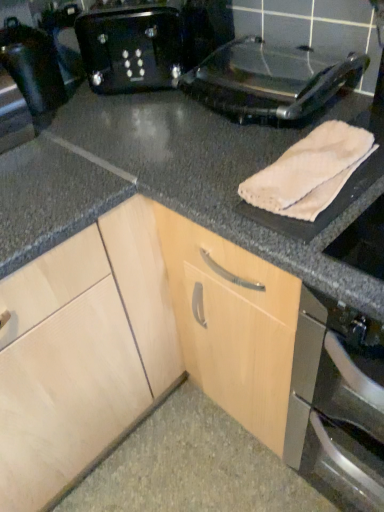
The height and width of the screenshot is (512, 384). What do you see at coordinates (13, 115) in the screenshot?
I see `shiny black toaster at left` at bounding box center [13, 115].

The height and width of the screenshot is (512, 384). I want to click on white fabric towel at right, so click(334, 412).

The image size is (384, 512). What do you see at coordinates (334, 412) in the screenshot?
I see `white fabric towel at right` at bounding box center [334, 412].

Measure the distance between point (178, 41) and camera.

Point (178, 41) and camera are 1.08 meters apart from each other.

What do you see at coordinates (149, 42) in the screenshot? This screenshot has height=512, width=384. I see `black plastic toaster at upper center` at bounding box center [149, 42].

Where is `shiny black toaster at left`? shiny black toaster at left is located at coordinates (13, 115).

Which object is positioned more to the right, metallic black toaster at upper right or beige soft towel at upper right?

beige soft towel at upper right is more to the right.

Looking at their sizes, would you say metallic black toaster at upper right is wider or thinner than beige soft towel at upper right?

metallic black toaster at upper right is wider than beige soft towel at upper right.

Is metallic black toaster at upper right outside of beige soft towel at upper right?

That's correct, metallic black toaster at upper right is outside of beige soft towel at upper right.

Between black plastic toaster at upper center and shiny black toaster at left, which one has larger size?

black plastic toaster at upper center.

Would you say black plastic toaster at upper center is inside or outside shiny black toaster at left?

black plastic toaster at upper center is spatially situated outside shiny black toaster at left.

Considering the relative sizes of black plastic toaster at upper center and shiny black toaster at left in the image provided, is black plastic toaster at upper center wider than shiny black toaster at left?

Yes.

Considering the positions of point (107, 31) and point (12, 136), is point (107, 31) closer or farther from the camera than point (12, 136)?

Point (107, 31) is farther from the camera than point (12, 136).

Which object is closer to the camera taking this photo, beige soft towel at upper right or shiny black toaster at left?

beige soft towel at upper right is more forward.

Based on the photo, based on their positions, is beige soft towel at upper right located to the left or right of shiny black toaster at left?

In the image, beige soft towel at upper right appears on the right side of shiny black toaster at left.

Is point (323, 153) positioned in front of point (1, 140)?

That is True.

Is beige soft towel at upper right oriented towards shiny black toaster at left?

No, beige soft towel at upper right is not oriented towards shiny black toaster at left.

Who is shorter, black plastic toaster at upper center or white fabric towel at right?

With less height is black plastic toaster at upper center.

From the image's perspective, would you say black plastic toaster at upper center is shown under white fabric towel at right?

No, from the image's perspective, black plastic toaster at upper center is not below white fabric towel at right.

Could white fabric towel at right be considered to be inside black plastic toaster at upper center?

Definitely not — white fabric towel at right is not inside black plastic toaster at upper center.

From the picture: Measure the distance from black plastic toaster at upper center to white fabric towel at right.

black plastic toaster at upper center and white fabric towel at right are 33.25 inches apart from each other.

Which of these two, white fabric towel at right or beige soft towel at upper right, is wider?

With larger width is white fabric towel at right.

Considering the sizes of objects white fabric towel at right and beige soft towel at upper right in the image provided, who is bigger, white fabric towel at right or beige soft towel at upper right?

With larger size is white fabric towel at right.

Can we say white fabric towel at right lies outside beige soft towel at upper right?

Yes, white fabric towel at right is located beyond the bounds of beige soft towel at upper right.

Does white fabric towel at right appear on the left side of beige soft towel at upper right?

In fact, white fabric towel at right is to the right of beige soft towel at upper right.

Is metallic black toaster at upper right bigger or smaller than black plastic toaster at upper center?

In the image, metallic black toaster at upper right appears to be larger than black plastic toaster at upper center.

From the picture: Is metallic black toaster at upper right at the right side of black plastic toaster at upper center?

Indeed, metallic black toaster at upper right is positioned on the right side of black plastic toaster at upper center.

Can you tell me how much metallic black toaster at upper right and black plastic toaster at upper center differ in facing direction?

There is a 43.9-degree angle between the facing directions of metallic black toaster at upper right and black plastic toaster at upper center.

Which is in front, metallic black toaster at upper right or black plastic toaster at upper center?

metallic black toaster at upper right is closer to the camera.

I want to click on bath towel below the black plastic toaster at upper center (from the image's perspective), so click(x=310, y=170).

Consider the image. Is black plastic toaster at upper center closer to camera compared to beige soft towel at upper right?

No.

From a real-world perspective, which is physically above, black plastic toaster at upper center or beige soft towel at upper right?

black plastic toaster at upper center, from a real-world perspective.

In the scene shown: Between black plastic toaster at upper center and beige soft towel at upper right, which one has larger size?

Bigger between the two is black plastic toaster at upper center.

Where is `bath towel directly beneath the metallic black toaster at upper right (from a real-world perspective)`? bath towel directly beneath the metallic black toaster at upper right (from a real-world perspective) is located at coordinates (310, 170).

At what (x,y) coordinates should I click in order to perform the action: click on toaster on the right side of shiny black toaster at left. Please return your answer as a coordinate pair (x, y). This screenshot has width=384, height=512. Looking at the image, I should click on (149, 42).

When comparing their distances from shiny black toaster at left, does black plastic toaster at upper center or metallic black toaster at upper right seem further?

metallic black toaster at upper right is positioned further to the anchor shiny black toaster at left.

Looking at the image, which one is located further to metallic black toaster at upper right, beige soft towel at upper right or shiny black toaster at left?

shiny black toaster at left is further to metallic black toaster at upper right.

When comparing their distances from shiny black toaster at left, does metallic black toaster at upper right or beige soft towel at upper right seem further?

Among the two, beige soft towel at upper right is located further to shiny black toaster at left.

Looking at the image, which one is located further to beige soft towel at upper right, white fabric towel at right or metallic black toaster at upper right?

white fabric towel at right is positioned further to the anchor beige soft towel at upper right.

Which object lies nearer to the anchor point black plastic toaster at upper center, white fabric towel at right or beige soft towel at upper right?

beige soft towel at upper right is positioned closer to the anchor black plastic toaster at upper center.

From the image, which object appears to be farther from black plastic toaster at upper center, beige soft towel at upper right or shiny black toaster at left?

beige soft towel at upper right is positioned further to the anchor black plastic toaster at upper center.

Looking at the image, which one is located further to white fabric towel at right, beige soft towel at upper right or shiny black toaster at left?

Among the two, shiny black toaster at left is located further to white fabric towel at right.

Considering their positions, is shiny black toaster at left positioned closer to beige soft towel at upper right than metallic black toaster at upper right?

metallic black toaster at upper right is closer to beige soft towel at upper right.

At what (x,y) coordinates should I click in order to perform the action: click on toaster between shiny black toaster at left and metallic black toaster at upper right from left to right. Please return your answer as a coordinate pair (x, y). Looking at the image, I should click on (149, 42).

What are the coordinates of `bath towel between shiny black toaster at left and white fabric towel at right in the horizontal direction` in the screenshot? It's located at (310, 170).

Where is `toaster between shiny black toaster at left and white fabric towel at right in the horizontal direction`? This screenshot has width=384, height=512. toaster between shiny black toaster at left and white fabric towel at right in the horizontal direction is located at coordinates (149, 42).

The height and width of the screenshot is (512, 384). I want to click on kitchen appliance between shiny black toaster at left and beige soft towel at upper right, so click(270, 80).